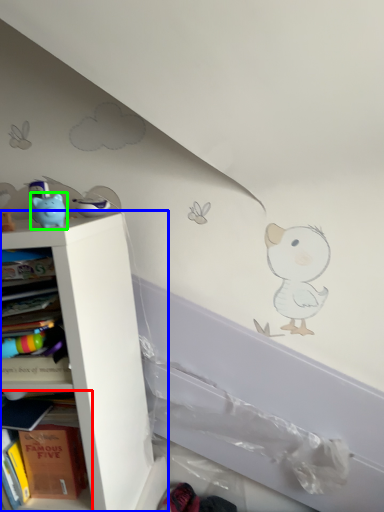
Question: Estimate the real-world distances between objects in this image. Which object is closer to shelf (highlighted by a red box), shelf (highlighted by a blue box) or toy (highlighted by a green box)?

Choices:
 (A) shelf
 (B) toy

Answer: (A)